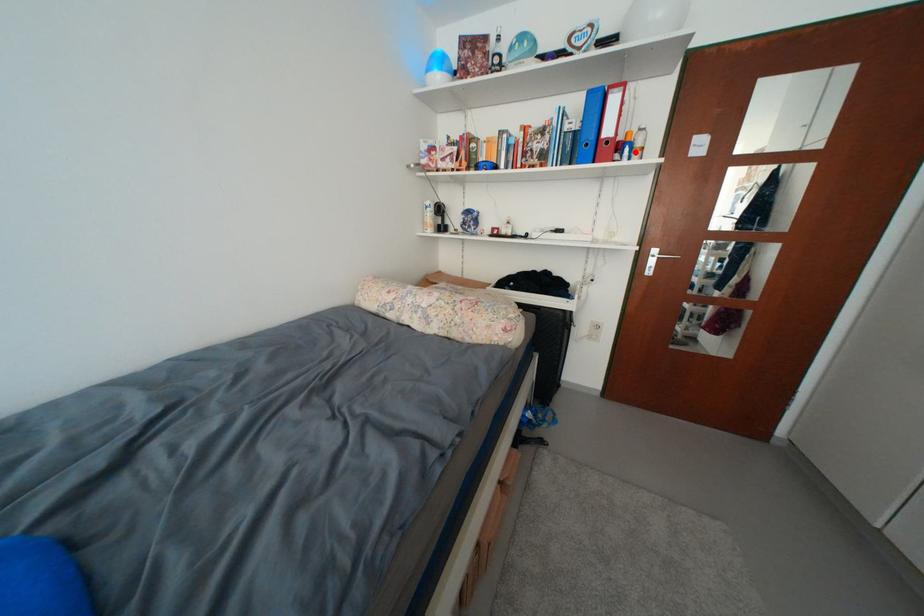
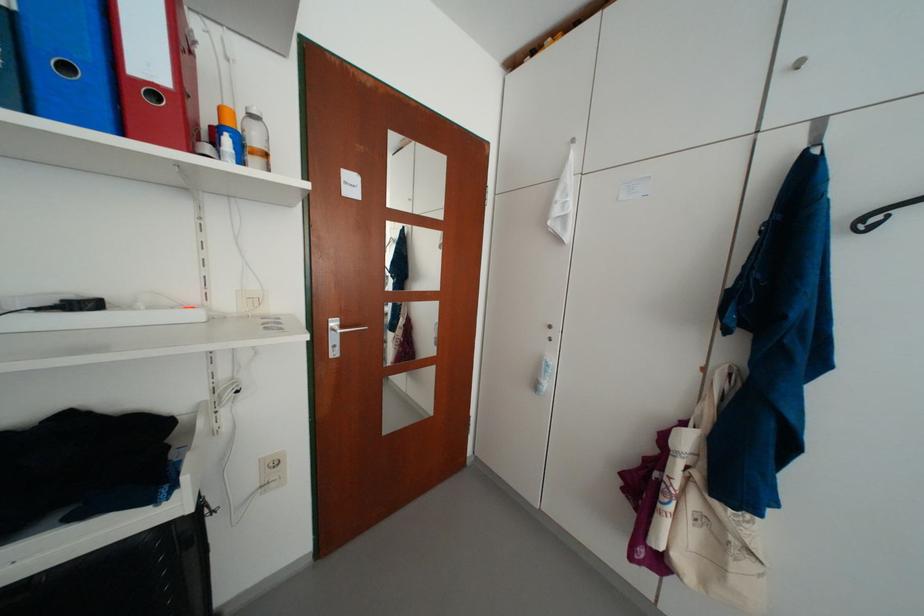
Question: I am providing you with two images of the same scene from different viewpoints. A red point is marked on the first image. Is the red point's position out of view in image 2?

Choices:
 (A) Yes
 (B) No

Answer: (B)